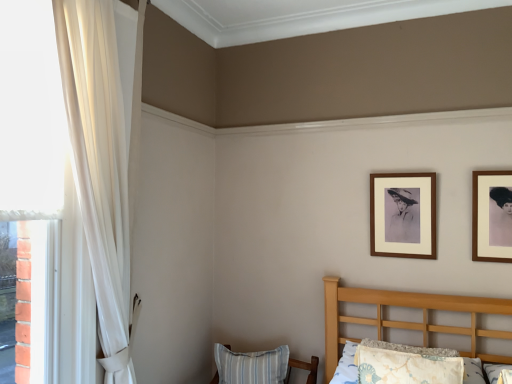
Question: Is brown wooden picture frame at upper right, which is the 1th picture frame from back to front, outside wooden picture frame at upper right, the 1th picture frame in the front-to-back sequence?

Choices:
 (A) no
 (B) yes

Answer: (B)

Question: Is brown wooden picture frame at upper right, which is the 1th picture frame from back to front, at the right side of wooden picture frame at upper right, positioned as the second picture frame in left-to-right order?

Choices:
 (A) no
 (B) yes

Answer: (A)

Question: Does brown wooden picture frame at upper right, which is counted as the second picture frame, starting from the right, have a larger size compared to wooden picture frame at upper right, the 1th picture frame in the front-to-back sequence?

Choices:
 (A) no
 (B) yes

Answer: (A)

Question: Can you confirm if brown wooden picture frame at upper right, which is the 2th picture frame in front-to-back order, is positioned to the left of wooden picture frame at upper right, positioned as the 1th picture frame in right-to-left order?

Choices:
 (A) yes
 (B) no

Answer: (A)

Question: Is brown wooden picture frame at upper right, which is counted as the first picture frame, starting from the left, oriented away from wooden picture frame at upper right, which is the second picture frame in back-to-front order?

Choices:
 (A) no
 (B) yes

Answer: (A)

Question: Looking at their shapes, would you say sheer white curtain at left is wider or thinner than fluffy white pillow at lower right, placed as the 1th pillow when sorted from top to bottom?

Choices:
 (A) wide
 (B) thin

Answer: (B)

Question: In the image, is sheer white curtain at left positioned in front of or behind fluffy white pillow at lower right, the 2th pillow in the back-to-front sequence?

Choices:
 (A) front
 (B) behind

Answer: (A)

Question: Would you say sheer white curtain at left is inside or outside fluffy white pillow at lower right, the 2th pillow in the back-to-front sequence?

Choices:
 (A) outside
 (B) inside

Answer: (A)

Question: Considering the positions of point (86, 62) and point (374, 379), is point (86, 62) closer or farther from the camera than point (374, 379)?

Choices:
 (A) closer
 (B) farther

Answer: (A)

Question: Based on their sizes in the image, would you say brown wooden picture frame at upper right, which is counted as the first picture frame, starting from the left, is bigger or smaller than blue striped pillow at lower center, which is counted as the second pillow, starting from the top?

Choices:
 (A) small
 (B) big

Answer: (A)

Question: Is point (388, 256) positioned closer to the camera than point (248, 362)?

Choices:
 (A) closer
 (B) farther

Answer: (A)

Question: Which is correct: brown wooden picture frame at upper right, which is counted as the second picture frame, starting from the right, is inside blue striped pillow at lower center, the first pillow positioned from the bottom, or outside of it?

Choices:
 (A) outside
 (B) inside

Answer: (A)

Question: Relative to blue striped pillow at lower center, the 1th pillow when ordered from left to right, is brown wooden picture frame at upper right, which is counted as the first picture frame, starting from the left, in front or behind?

Choices:
 (A) front
 (B) behind

Answer: (A)

Question: From a real-world perspective, is wooden picture frame at upper right, the 1th picture frame in the front-to-back sequence, physically located above or below fluffy white pillow at lower right, which is the 1th pillow from front to back?

Choices:
 (A) below
 (B) above

Answer: (B)

Question: In the image, is wooden picture frame at upper right, positioned as the 1th picture frame in right-to-left order, positioned in front of or behind fluffy white pillow at lower right, placed as the 1th pillow when sorted from top to bottom?

Choices:
 (A) behind
 (B) front

Answer: (A)